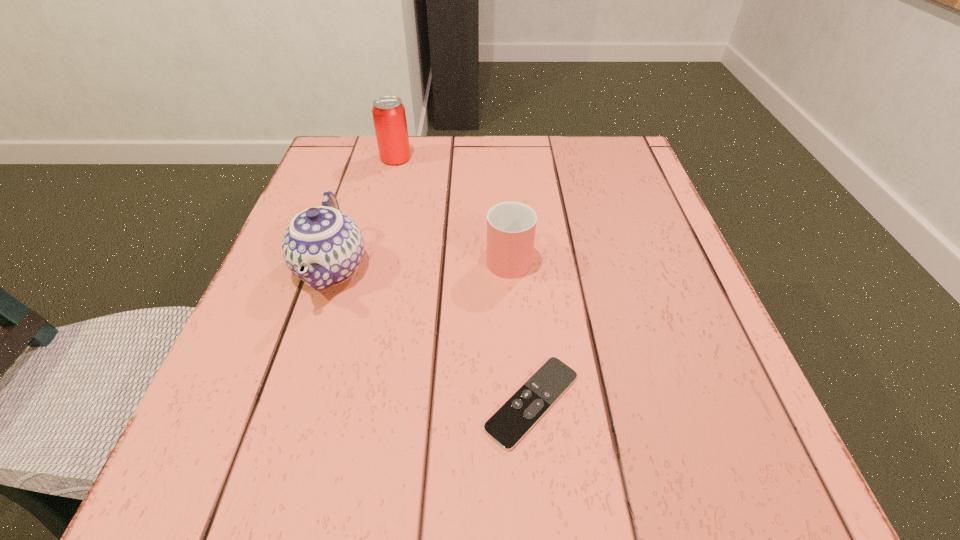
In the image, there is a desktop. Where is `vacant space at the far left corner`? The height and width of the screenshot is (540, 960). vacant space at the far left corner is located at coordinates (356, 176).

Where is `free region at the far right corner of the desktop`? Image resolution: width=960 pixels, height=540 pixels. free region at the far right corner of the desktop is located at coordinates (608, 174).

Image resolution: width=960 pixels, height=540 pixels. I want to click on vacant space at the near right corner of the desktop, so click(x=665, y=470).

The width and height of the screenshot is (960, 540). Identify the location of free area in between the remote control and the cup. (520, 329).

Identify the location of vacant area between the chinaware and the cup. (420, 262).

At what (x,y) coordinates should I click in order to perform the action: click on free space between the can and the second shortest object. Please return your answer as a coordinate pair (x, y). Looking at the image, I should click on (452, 207).

This screenshot has width=960, height=540. I want to click on vacant region between the nearest object and the third tallest object, so click(x=520, y=329).

This screenshot has height=540, width=960. I want to click on vacant space that is in between the second shortest object and the remote control, so click(520, 329).

Locate an element on the screen. free space between the chinaware and the nearest object is located at coordinates (432, 335).

You are a GUI agent. You are given a task and a screenshot of the screen. Output one action in this format:
    pyautogui.click(x=<x>, y=<y>)
    Task: Click on the vacant area that lies between the cup and the shortest object
    The width and height of the screenshot is (960, 540).
    Given the screenshot: What is the action you would take?
    pyautogui.click(x=520, y=329)